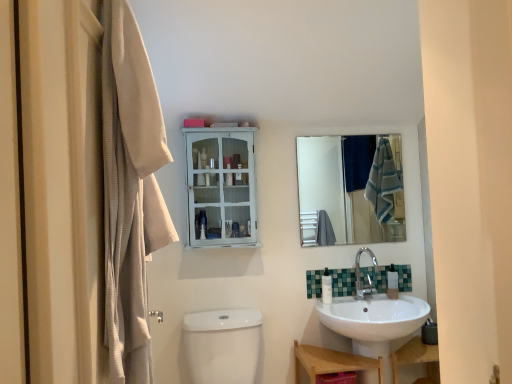
Question: Is metallic silver faucet at lower center oriented towards clear glass mirror at upper center?

Choices:
 (A) no
 (B) yes

Answer: (A)

Question: Can you confirm if metallic silver faucet at lower center is taller than clear glass mirror at upper center?

Choices:
 (A) yes
 (B) no

Answer: (B)

Question: Is metallic silver faucet at lower center not close to clear glass mirror at upper center?

Choices:
 (A) yes
 (B) no

Answer: (B)

Question: Is the surface of metallic silver faucet at lower center in direct contact with clear glass mirror at upper center?

Choices:
 (A) no
 (B) yes

Answer: (A)

Question: Does metallic silver faucet at lower center appear on the right side of clear glass mirror at upper center?

Choices:
 (A) yes
 (B) no

Answer: (A)

Question: From the image's perspective, is metallic silver faucet at lower center located above clear glass mirror at upper center?

Choices:
 (A) no
 (B) yes

Answer: (A)

Question: From a real-world perspective, is silver metallic faucet at lower right on top of white glossy toilet bowl at lower center?

Choices:
 (A) no
 (B) yes

Answer: (B)

Question: Is silver metallic faucet at lower right aimed at white glossy toilet bowl at lower center?

Choices:
 (A) no
 (B) yes

Answer: (A)

Question: Does silver metallic faucet at lower right have a larger size compared to white glossy toilet bowl at lower center?

Choices:
 (A) yes
 (B) no

Answer: (B)

Question: Considering the relative sizes of silver metallic faucet at lower right and white glossy toilet bowl at lower center in the image provided, is silver metallic faucet at lower right taller than white glossy toilet bowl at lower center?

Choices:
 (A) yes
 (B) no

Answer: (B)

Question: Does silver metallic faucet at lower right have a greater width compared to white glossy toilet bowl at lower center?

Choices:
 (A) yes
 (B) no

Answer: (B)

Question: Is silver metallic faucet at lower right smaller than white glossy toilet bowl at lower center?

Choices:
 (A) no
 (B) yes

Answer: (B)

Question: Is white painted wood cabinet at upper center at the left side of wooden shelf at lower right?

Choices:
 (A) yes
 (B) no

Answer: (A)